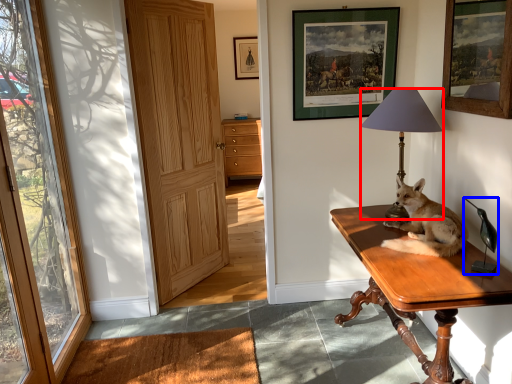
Question: Which object is further to the camera taking this photo, lamp (highlighted by a red box) or corded phone (highlighted by a blue box)?

Choices:
 (A) lamp
 (B) corded phone

Answer: (A)